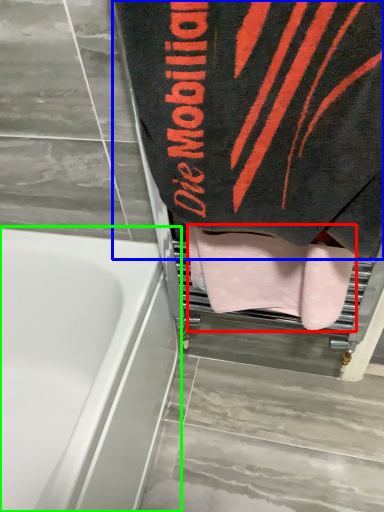
Question: Which object is positioned farthest from towel (highlighted by a red box)? Select from towel (highlighted by a blue box) and bathtub (highlighted by a green box).

Choices:
 (A) towel
 (B) bathtub

Answer: (B)